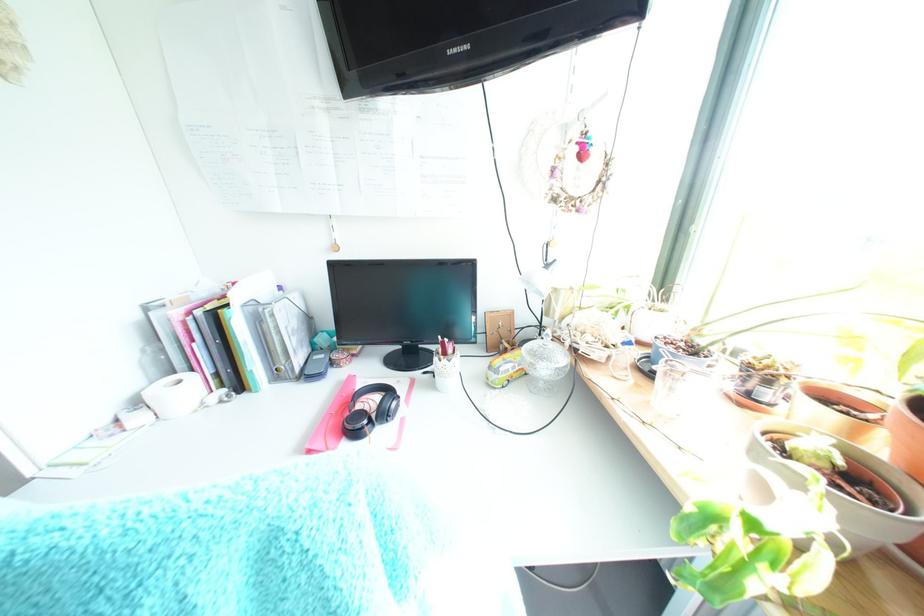
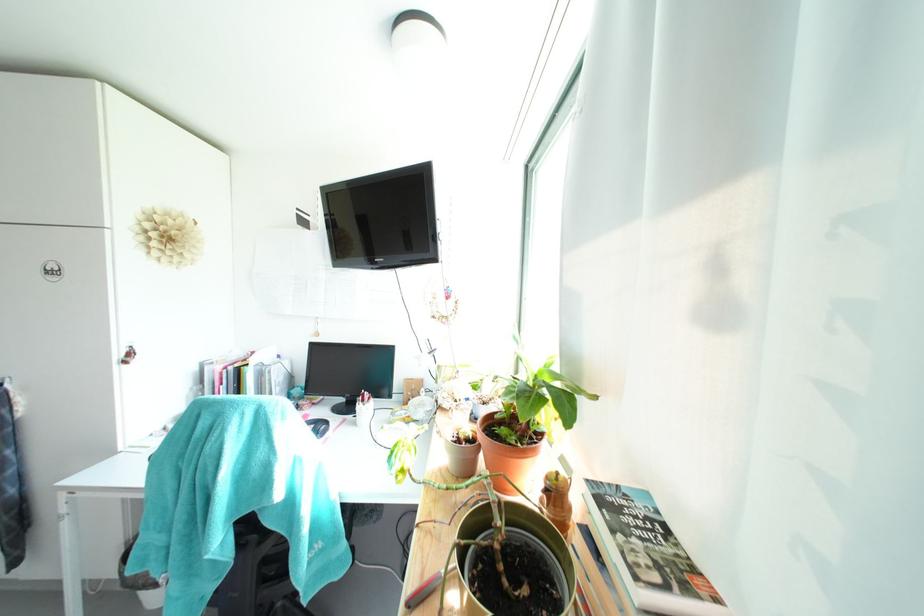
The images are taken continuously from a first-person perspective. In which direction are you moving?

The cameraman moved toward right, backward.